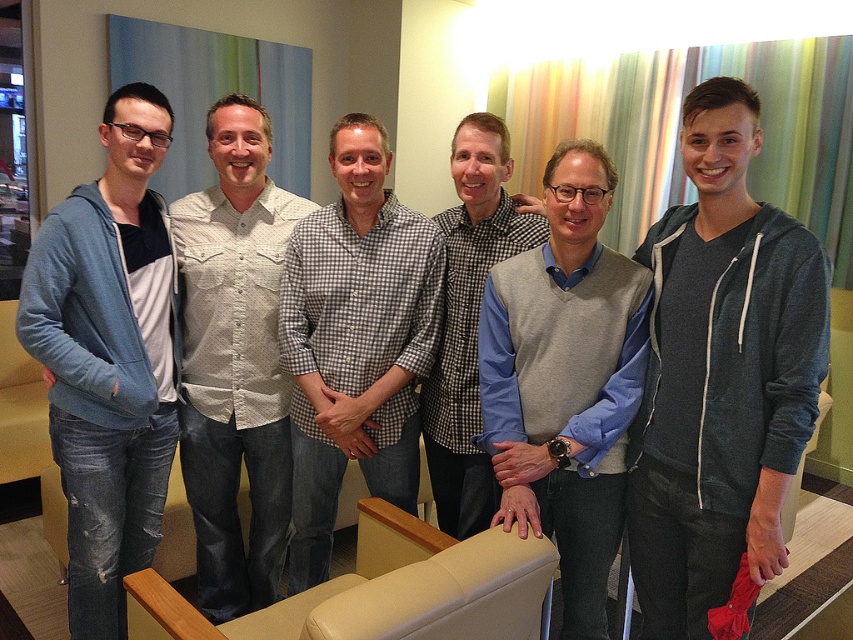
Can you confirm if denim jacket at left is positioned to the right of checkered fabric shirt at center?

No, denim jacket at left is not to the right of checkered fabric shirt at center.

In order to click on denim jacket at left in this screenshot , I will do `click(108, 356)`.

Locate an element on the screen. The height and width of the screenshot is (640, 853). denim jacket at left is located at coordinates (108, 356).

Does dark gray hoodie at right appear under light gray sweater vest at center?

No, dark gray hoodie at right is not below light gray sweater vest at center.

Between dark gray hoodie at right and light gray sweater vest at center, which one is positioned higher?

dark gray hoodie at right is higher up.

What do you see at coordinates (721, 374) in the screenshot? This screenshot has height=640, width=853. I see `dark gray hoodie at right` at bounding box center [721, 374].

Find the location of a particular element. This screenshot has height=640, width=853. dark gray hoodie at right is located at coordinates (721, 374).

Between point (561, 536) and point (189, 225), which one is positioned in front?

Positioned in front is point (561, 536).

Does light gray sweater vest at center lie in front of light beige textured shirt at center?

Yes, light gray sweater vest at center is in front of light beige textured shirt at center.

The width and height of the screenshot is (853, 640). What do you see at coordinates (566, 380) in the screenshot?
I see `light gray sweater vest at center` at bounding box center [566, 380].

Find the location of a particular element. The width and height of the screenshot is (853, 640). light gray sweater vest at center is located at coordinates (566, 380).